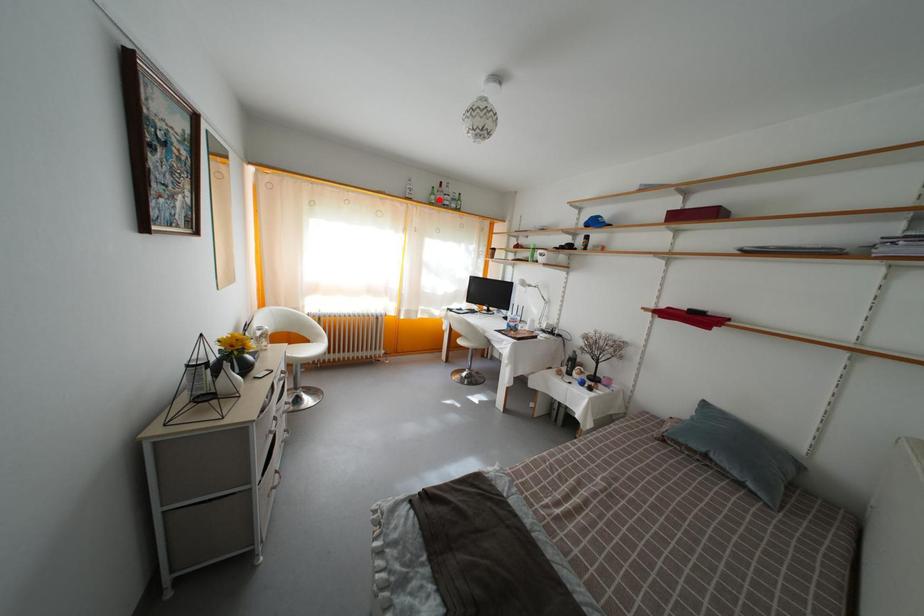
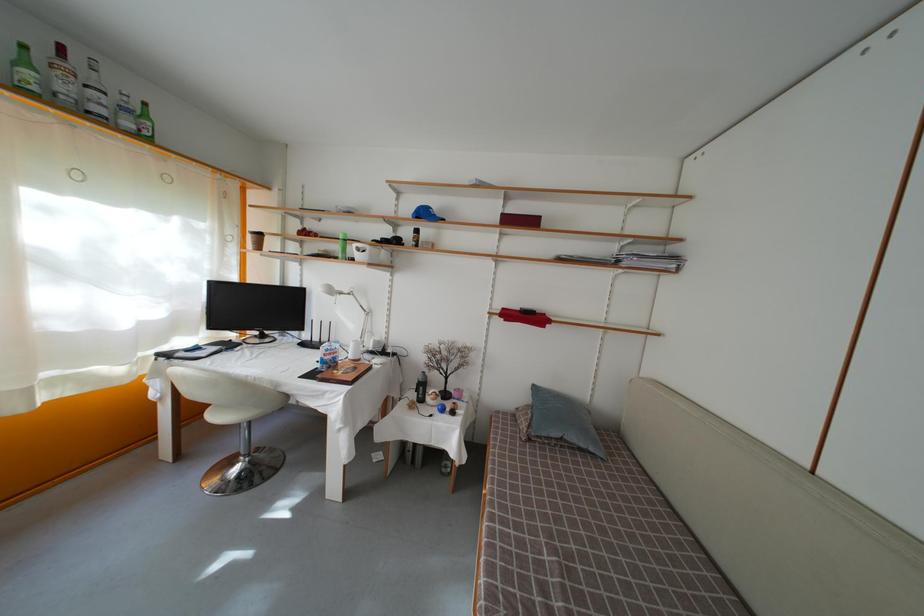
Question: I am providing you with two images of the same scene from different viewpoints. In image1, a red point is highlighted. Considering the same 3D point in image2, which of the following is correct?

Choices:
 (A) It is closer
 (B) It is farther

Answer: (B)